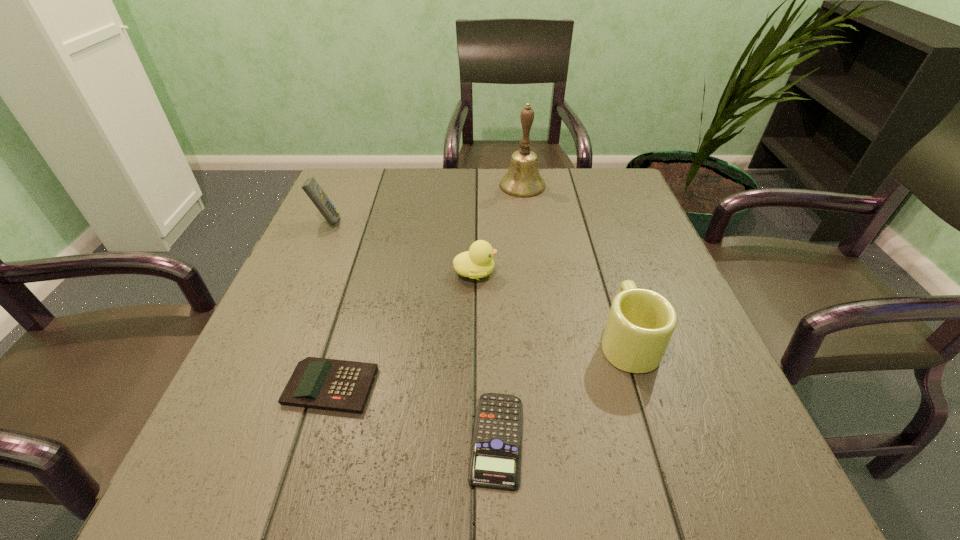
Image resolution: width=960 pixels, height=540 pixels. Find the location of `the tallest object`. the tallest object is located at coordinates (523, 179).

Where is `bell`? bell is located at coordinates (523, 179).

You are a GUI agent. You are given a task and a screenshot of the screen. Output one action in this format:
    pyautogui.click(x=<x>, y=<y>)
    Task: Click on the leftmost object
    This screenshot has height=540, width=960.
    Given the screenshot: What is the action you would take?
    pyautogui.click(x=311, y=187)

Locate an element on the screen. This screenshot has width=960, height=540. the leftmost calculator is located at coordinates (311, 187).

This screenshot has height=540, width=960. What are the coordinates of `the rightmost object` in the screenshot? It's located at (641, 322).

At what (x,y) coordinates should I click in order to perform the action: click on the third farthest object. Please return your answer as a coordinate pair (x, y). This screenshot has width=960, height=540. Looking at the image, I should click on (478, 262).

Where is `duckling`? duckling is located at coordinates (478, 262).

The height and width of the screenshot is (540, 960). I want to click on the second tallest calculator, so [328, 384].

Find the location of `the fifth tallest object`. the fifth tallest object is located at coordinates (328, 384).

At what (x,y) coordinates should I click in order to perform the action: click on the shortest calculator. Please return your answer as a coordinate pair (x, y). Looking at the image, I should click on (495, 460).